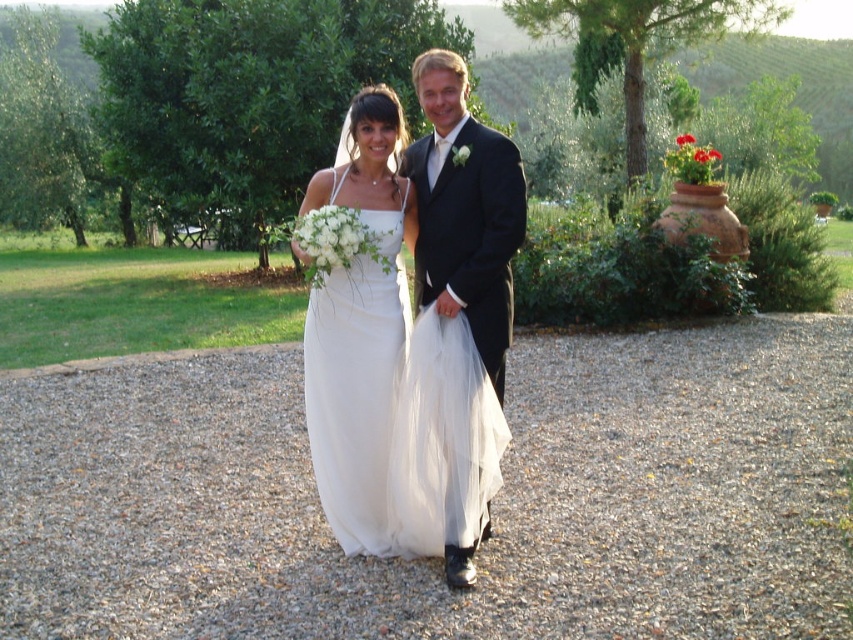
Who is positioned more to the right, white tulle dress at center or white satin dress at center?

From the viewer's perspective, white tulle dress at center appears more on the right side.

Which is more to the left, white tulle dress at center or white satin dress at center?

white satin dress at center

Does point (389, 484) lie behind point (335, 324)?

That is False.

Find the location of a particular element. white tulle dress at center is located at coordinates (397, 419).

In the scene shown: Which of these two, gray gravel at center or black satin suit at center, stands taller?

black satin suit at center

In order to click on gray gravel at center in this screenshot , I will do `click(492, 506)`.

Can you confirm if white tulle dress at center is wider than black satin suit at center?

Yes.

Between point (392, 323) and point (508, 173), which one is positioned in front?

Point (508, 173)

At what (x,y) coordinates should I click in order to perform the action: click on white tulle dress at center. Please return your answer as a coordinate pair (x, y). The image size is (853, 640). Looking at the image, I should click on (397, 419).